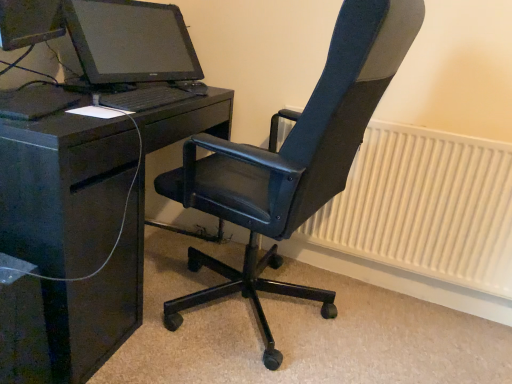
Where is `black glossy desk at left`? black glossy desk at left is located at coordinates pos(64,189).

What do you see at coordinates (64, 189) in the screenshot? I see `black glossy desk at left` at bounding box center [64, 189].

You are a GUI agent. You are given a task and a screenshot of the screen. Output one action in this format:
    pyautogui.click(x=<x>, y=<y>)
    Task: Click on the white textured radiator at right
    
    Given the screenshot: What is the action you would take?
    pyautogui.click(x=425, y=207)

Where is `black matte keyboard at center`? This screenshot has height=384, width=512. black matte keyboard at center is located at coordinates (150, 97).

From the picture: How much distance is there between black glossy desk at left and black leather office chair at center?

A distance of 15.81 inches exists between black glossy desk at left and black leather office chair at center.

Who is smaller, black glossy desk at left or black leather office chair at center?

black glossy desk at left.

Looking at this image, which is more to the right, black glossy desk at left or black leather office chair at center?

From the viewer's perspective, black leather office chair at center appears more on the right side.

From the image's perspective, is black glossy desk at left on top of black leather office chair at center?

No, from the image's perspective, black glossy desk at left is not on top of black leather office chair at center.

From the image's perspective, which is above, black matte keyboard at center or black leather office chair at center?

black matte keyboard at center.

Looking at their sizes, would you say black matte keyboard at center is wider or thinner than black leather office chair at center?

Clearly, black matte keyboard at center has less width compared to black leather office chair at center.

Identify the location of computer keyboard behind the black leather office chair at center. (150, 97).

Considering the sizes of objects black glossy desk at left and white textured radiator at right in the image provided, who is shorter, black glossy desk at left or white textured radiator at right?

With less height is white textured radiator at right.

From a real-world perspective, is black glossy desk at left physically located above or below white textured radiator at right?

In terms of real-world spatial position, black glossy desk at left is above white textured radiator at right.

Considering their positions, is black glossy desk at left located in front of or behind white textured radiator at right?

In the image, black glossy desk at left appears in front of white textured radiator at right.

I want to click on radiator that is behind the black glossy desk at left, so click(x=425, y=207).

Between black glossy desk at left and black matte keyboard at center, which one has more height?

With more height is black glossy desk at left.

Between black glossy desk at left and black matte keyboard at center, which one has smaller width?

black matte keyboard at center.

Who is more distant, black glossy desk at left or black matte keyboard at center?

black matte keyboard at center is behind.

Who is smaller, black glossy desk at left or black matte keyboard at center?

Smaller between the two is black matte keyboard at center.

Is point (378, 242) behind point (223, 172)?

Yes.

Is white textured radiator at right looking in the opposite direction of black leather office chair at center?

No, white textured radiator at right's orientation is not away from black leather office chair at center.

From a real-world perspective, is white textured radiator at right located beneath black leather office chair at center?

Yes, from a real-world perspective, white textured radiator at right is under black leather office chair at center.

Which point is more forward, [88,61] or [288,151]?

Point [288,151]

Where is `chair below the matte black monitor at upper left (from the image's perspective)`? The image size is (512, 384). chair below the matte black monitor at upper left (from the image's perspective) is located at coordinates (293, 160).

Is matte black monitor at upper left turned away from black leather office chair at center?

No, matte black monitor at upper left's orientation is not away from black leather office chair at center.

Between matte black monitor at upper left and black leather office chair at center, which one has smaller width?

matte black monitor at upper left is thinner.

Could you tell me if black glossy desk at left is facing matte black monitor at upper left?

No, black glossy desk at left is not facing towards matte black monitor at upper left.

Is black glossy desk at left at the left side of matte black monitor at upper left?

Yes.

This screenshot has width=512, height=384. I want to click on desk on the left side of matte black monitor at upper left, so click(x=64, y=189).

From the image's perspective, is black glossy desk at left located beneath matte black monitor at upper left?

Indeed, from the image's perspective, black glossy desk at left is shown beneath matte black monitor at upper left.

Image resolution: width=512 pixels, height=384 pixels. I want to click on chair above the black glossy desk at left (from a real-world perspective), so click(293, 160).

In order to click on computer keyboard that is on the left side of black leather office chair at center in this screenshot , I will do `click(150, 97)`.

Considering their positions, is black glossy desk at left positioned closer to black leather office chair at center than matte black monitor at upper left?

Among the two, black glossy desk at left is located nearer to black leather office chair at center.

Considering their positions, is white textured radiator at right positioned further to black matte keyboard at center than black leather office chair at center?

The object further to black matte keyboard at center is white textured radiator at right.

From the image, which object appears to be farther from black leather office chair at center, black glossy desk at left or white textured radiator at right?

white textured radiator at right lies further to black leather office chair at center than the other object.

Considering their positions, is black matte keyboard at center positioned closer to white textured radiator at right than black leather office chair at center?

black leather office chair at center.

From the image, which object appears to be nearer to white textured radiator at right, black leather office chair at center or black glossy desk at left?

The object closer to white textured radiator at right is black leather office chair at center.

When comparing their distances from white textured radiator at right, does matte black monitor at upper left or black matte keyboard at center seem further?

matte black monitor at upper left lies further to white textured radiator at right than the other object.

Based on their spatial positions, is black matte keyboard at center or black glossy desk at left closer to black leather office chair at center?

Based on the image, black glossy desk at left appears to be nearer to black leather office chair at center.

Considering their positions, is matte black monitor at upper left positioned closer to white textured radiator at right than black glossy desk at left?

black glossy desk at left is closer to white textured radiator at right.

The height and width of the screenshot is (384, 512). Find the location of `computer keyboard between matte black monitor at upper left and black glossy desk at left in the vertical direction`. computer keyboard between matte black monitor at upper left and black glossy desk at left in the vertical direction is located at coordinates (150, 97).

This screenshot has width=512, height=384. Identify the location of chair between matte black monitor at upper left and white textured radiator at right in the horizontal direction. (293, 160).

This screenshot has height=384, width=512. Find the location of `computer keyboard located between black glossy desk at left and white textured radiator at right in the left-right direction`. computer keyboard located between black glossy desk at left and white textured radiator at right in the left-right direction is located at coordinates (150, 97).

Locate an element on the screen. The height and width of the screenshot is (384, 512). chair between black glossy desk at left and white textured radiator at right is located at coordinates tap(293, 160).